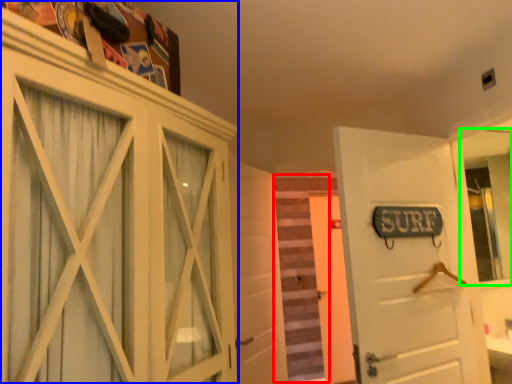
Question: Which is nearer to the stair (highlighted by a red box)? cabinetry (highlighted by a blue box) or mirror (highlighted by a green box).

Choices:
 (A) cabinetry
 (B) mirror

Answer: (B)